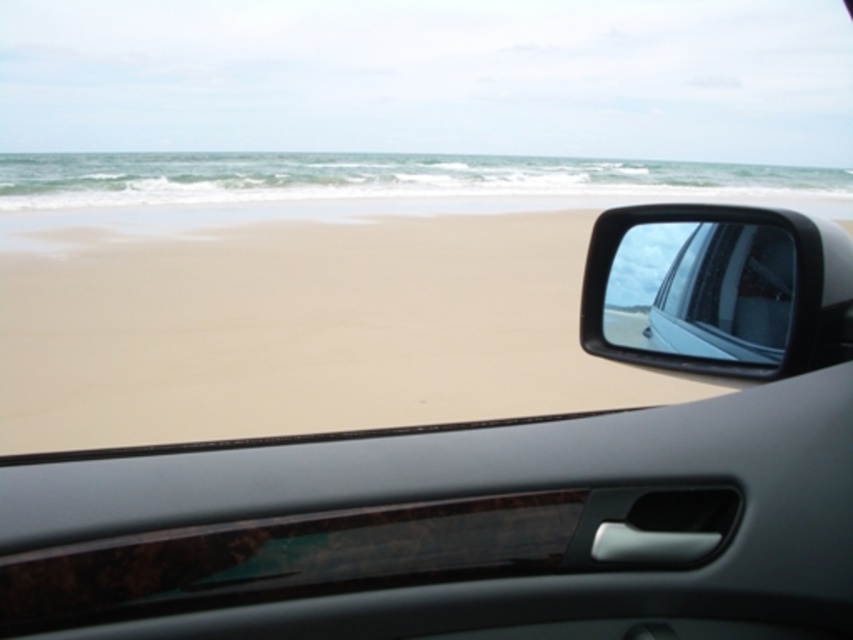
You are sitting in the car and looking out through the window. You see the sandy beach at lower left and the glossy plastic car mirror at upper right. Which object takes up more space in your view?

→ The glossy plastic car mirror at upper right takes up more space in your view because it is larger than the sandy beach at lower left.

You are sitting in the car and want to see the sandy beach at lower left through the glossy plastic car mirror at upper right. Is this possible?

The glossy plastic car mirror at upper right is behind the sandy beach at lower left, so it cannot be used to view the sandy beach at lower left from the car.